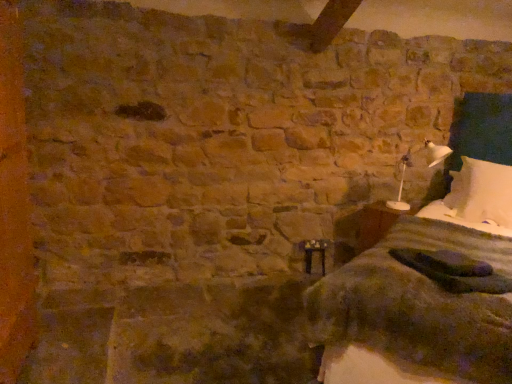
At what (x,y) coordinates should I click in order to perform the action: click on white soft pillow at right. Please return your answer as a coordinate pair (x, y). This screenshot has width=512, height=384. Looking at the image, I should click on (480, 195).

Looking at this image, measure the distance between point (496,219) and camera.

Point (496,219) and camera are 2.96 meters apart.

Locate an element on the screen. The height and width of the screenshot is (384, 512). wooden bedside table at lower right is located at coordinates (378, 221).

The image size is (512, 384). What do you see at coordinates (435, 273) in the screenshot? I see `white cotton bed at right` at bounding box center [435, 273].

At what (x,y) coordinates should I click in order to perform the action: click on white plastic lamp at right. Please return your answer as a coordinate pair (x, y). Image resolution: width=512 pixels, height=384 pixels. Looking at the image, I should click on (437, 152).

Is wooden bedside table at lower right at the right side of white plastic lamp at right?

No.

From a real-world perspective, is wooden bedside table at lower right physically below white plastic lamp at right?

Yes, from a real-world perspective, wooden bedside table at lower right is under white plastic lamp at right.

Is point (372, 231) closer or farther from the camera than point (408, 206)?

Point (372, 231) is positioned closer to the camera compared to point (408, 206).

In the scene shown: From a real-world perspective, does wooden bedside table at lower right sit lower than white cotton bed at right?

Yes, from a real-world perspective, wooden bedside table at lower right is below white cotton bed at right.

Is wooden bedside table at lower right facing towards white cotton bed at right?

No, wooden bedside table at lower right is not facing towards white cotton bed at right.

From the image's perspective, is wooden bedside table at lower right on white cotton bed at right?

Incorrect, from the image's perspective, wooden bedside table at lower right is lower than white cotton bed at right.

Based on their sizes in the image, would you say wooden bedside table at lower right is bigger or smaller than white cotton bed at right?

In the image, wooden bedside table at lower right appears to be smaller than white cotton bed at right.

Looking at this image, could you tell me if white plastic lamp at right is turned towards white soft pillow at right?

No, white plastic lamp at right does not turn towards white soft pillow at right.

Considering the relative sizes of white plastic lamp at right and white soft pillow at right in the image provided, is white plastic lamp at right smaller than white soft pillow at right?

Yes.

Which object is wider, white plastic lamp at right or white soft pillow at right?

With larger width is white plastic lamp at right.

How many degrees apart are the facing directions of white plastic lamp at right and white soft pillow at right?

There is a 47.5-degree angle between the facing directions of white plastic lamp at right and white soft pillow at right.

Is point (361, 234) farther from camera compared to point (506, 228)?

Yes, point (361, 234) is farther from viewer.

In the scene shown: Is wooden bedside table at lower right positioned with its back to white soft pillow at right?

That's not correct — wooden bedside table at lower right is not looking away from white soft pillow at right.

Do you think wooden bedside table at lower right is within white soft pillow at right, or outside of it?

wooden bedside table at lower right lies outside white soft pillow at right.

Is wooden bedside table at lower right to the left of white soft pillow at right from the viewer's perspective?

Yes, wooden bedside table at lower right is to the left of white soft pillow at right.

From a real-world perspective, who is located higher, white soft pillow at right or white plastic lamp at right?

From a 3D spatial view, white plastic lamp at right is above.

Is white soft pillow at right in front of or behind white plastic lamp at right in the image?

white soft pillow at right is positioned farther from the viewer than white plastic lamp at right.

Based on the photo, measure the distance from white soft pillow at right to white plastic lamp at right.

They are 50.71 centimeters apart.

From the picture: Between white soft pillow at right and white plastic lamp at right, which one appears on the left side from the viewer's perspective?

Positioned to the left is white plastic lamp at right.

Which is more to the left, white cotton bed at right or white plastic lamp at right?

white plastic lamp at right.

Is white cotton bed at right far away from white plastic lamp at right?

Actually, white cotton bed at right and white plastic lamp at right are a little close together.

From the picture: How much distance is there between white cotton bed at right and white plastic lamp at right?

white cotton bed at right and white plastic lamp at right are 38.99 inches apart from each other.

Which object is closer to the camera taking this photo, white cotton bed at right or white plastic lamp at right?

white cotton bed at right is closer to the camera.

Considering the sizes of objects white cotton bed at right and white soft pillow at right in the image provided, who is taller, white cotton bed at right or white soft pillow at right?

white cotton bed at right.

Does white cotton bed at right appear on the right side of white soft pillow at right?

In fact, white cotton bed at right is to the left of white soft pillow at right.

Is white cotton bed at right not near white soft pillow at right?

Actually, white cotton bed at right and white soft pillow at right are a little close together.

From the image's perspective, who appears lower, white cotton bed at right or white soft pillow at right?

From the image's view, white cotton bed at right is below.

Locate an element on the screen. This screenshot has width=512, height=384. table located behind the white plastic lamp at right is located at coordinates (378, 221).

Identify the location of bed lying on the right of wooden bedside table at lower right. The width and height of the screenshot is (512, 384). (435, 273).

Which object lies further to the anchor point white cotton bed at right, wooden bedside table at lower right or white soft pillow at right?

wooden bedside table at lower right is further to white cotton bed at right.

Estimate the real-world distances between objects in this image. Which object is further from white plastic lamp at right, white cotton bed at right or wooden bedside table at lower right?

The object further to white plastic lamp at right is white cotton bed at right.

When comparing their distances from white soft pillow at right, does white cotton bed at right or white plastic lamp at right seem closer?

The object closer to white soft pillow at right is white cotton bed at right.

Based on their spatial positions, is white soft pillow at right or wooden bedside table at lower right closer to white plastic lamp at right?

wooden bedside table at lower right.

From the image, which object appears to be nearer to white cotton bed at right, white soft pillow at right or white plastic lamp at right?

The object closer to white cotton bed at right is white soft pillow at right.

Estimate the real-world distances between objects in this image. Which object is further from white soft pillow at right, wooden bedside table at lower right or white cotton bed at right?

wooden bedside table at lower right.

Based on their spatial positions, is white cotton bed at right or white soft pillow at right further from wooden bedside table at lower right?

Among the two, white cotton bed at right is located further to wooden bedside table at lower right.

Considering their positions, is wooden bedside table at lower right positioned closer to white plastic lamp at right than white cotton bed at right?

wooden bedside table at lower right lies closer to white plastic lamp at right than the other object.

The image size is (512, 384). Find the location of `bedside lamp located between white cotton bed at right and white soft pillow at right in the depth direction`. bedside lamp located between white cotton bed at right and white soft pillow at right in the depth direction is located at coordinates (437, 152).

Find the location of a particular element. bedside lamp located between white cotton bed at right and wooden bedside table at lower right in the depth direction is located at coordinates (437, 152).

The width and height of the screenshot is (512, 384). Find the location of `pillow between white cotton bed at right and wooden bedside table at lower right along the z-axis`. pillow between white cotton bed at right and wooden bedside table at lower right along the z-axis is located at coordinates (480, 195).

You are a GUI agent. You are given a task and a screenshot of the screen. Output one action in this format:
    pyautogui.click(x=<x>, y=<y>)
    Task: Click on the bedside lamp between wooden bedside table at lower right and white soft pillow at right
    The image size is (512, 384).
    Given the screenshot: What is the action you would take?
    pyautogui.click(x=437, y=152)